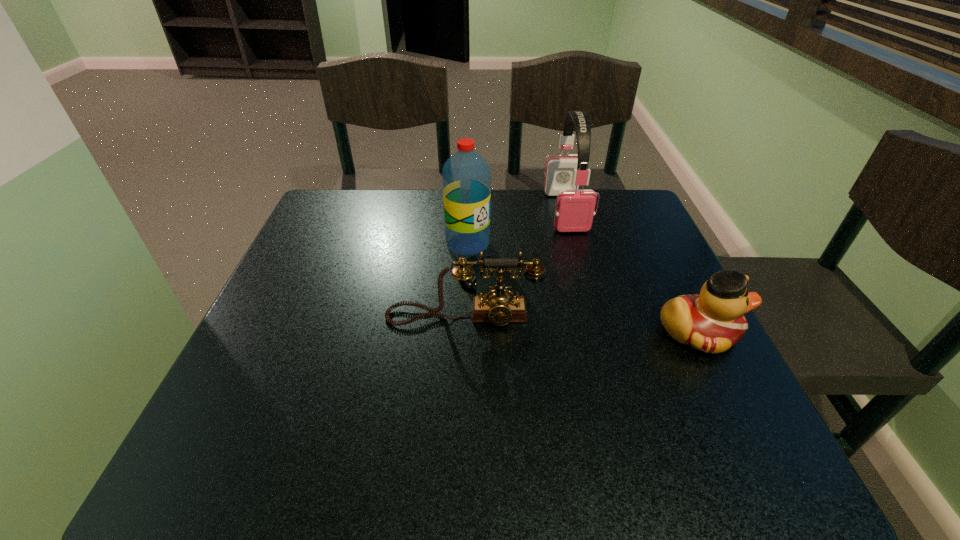
This screenshot has height=540, width=960. I want to click on vacant area at the far left corner, so (366, 198).

In the image, there is a desktop. Identify the location of vacant space at the far right corner. (602, 222).

Identify the location of free space that is in between the third object from left to right and the rightmost object. (632, 272).

Image resolution: width=960 pixels, height=540 pixels. I want to click on vacant area between the duck and the third object from left to right, so click(x=632, y=272).

Locate an element on the screen. This screenshot has width=960, height=540. free area in between the telephone and the duck is located at coordinates (581, 325).

Find the location of a particular element. Image resolution: width=960 pixels, height=540 pixels. free space between the rightmost object and the water bottle is located at coordinates coord(583,288).

The image size is (960, 540). Find the location of `free space between the second object from right to left and the water bottle`. free space between the second object from right to left and the water bottle is located at coordinates (516, 227).

Where is `blank region between the rightmost object and the water bottle`? The width and height of the screenshot is (960, 540). blank region between the rightmost object and the water bottle is located at coordinates (583, 288).

Where is `the closest object to the telephone`? the closest object to the telephone is located at coordinates (466, 177).

Locate an element on the screen. object identified as the closest to the duck is located at coordinates (500, 307).